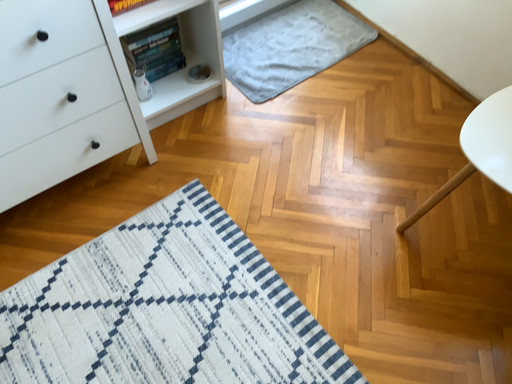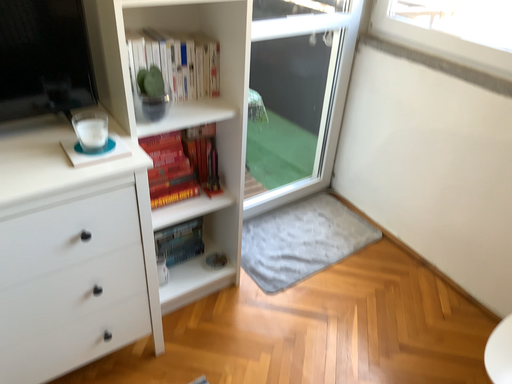
Question: How did the camera likely rotate when shooting the video?

Choices:
 (A) rotated downward
 (B) rotated upward

Answer: (B)